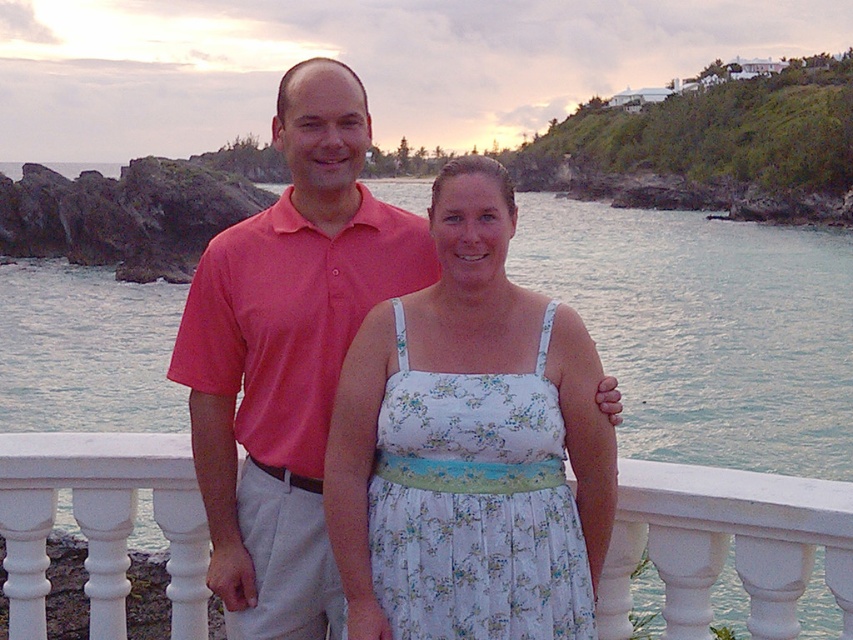
Consider the image. You are a photographer trying to capture a shot of the pink cotton shirt at upper left and the floral cotton dress at center. Which of the two clothing items is closer to the camera?

The pink cotton shirt at upper left is positioned over the floral cotton dress at center, meaning it is closer to the camera.